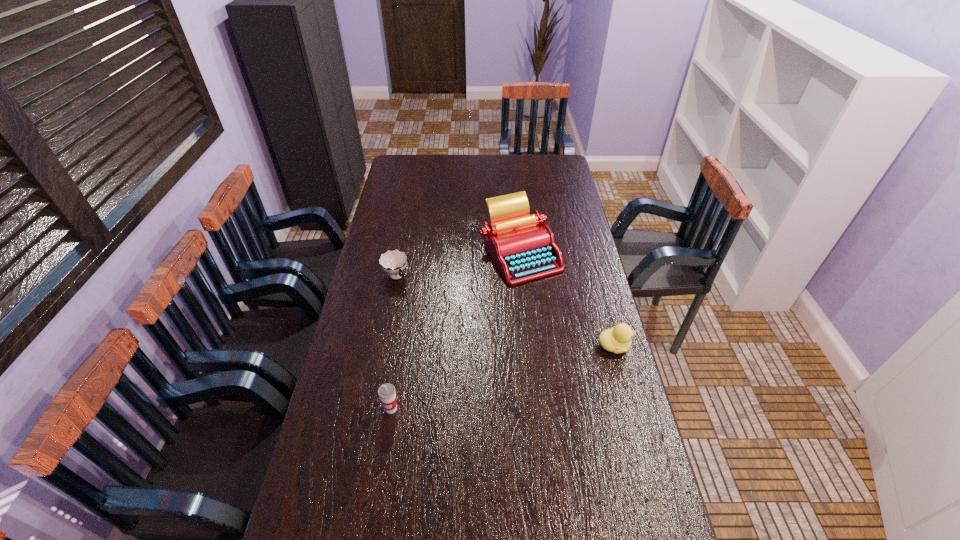
Identify the location of free spot on the desktop that is between the taller cup and the duckling and is positioned on the side of the shorter cup with the handle. 488,381.

In order to click on vacant space on the desktop that is between the third shortest object and the rightmost object and is positioned on the typing side of the typewriter in this screenshot , I will do `click(506, 376)`.